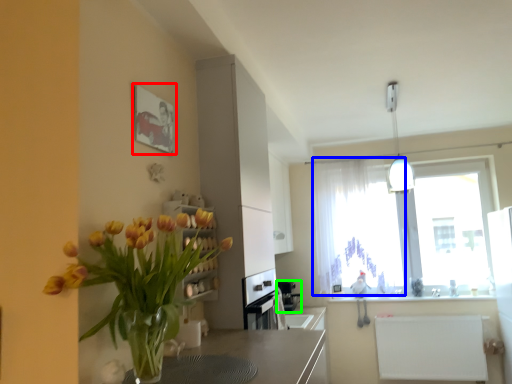
Question: Based on their relative distances, which object is nearer to picture frame (highlighted by a red box)? Choose from curtain (highlighted by a blue box) and appliance (highlighted by a green box).

Choices:
 (A) curtain
 (B) appliance

Answer: (A)